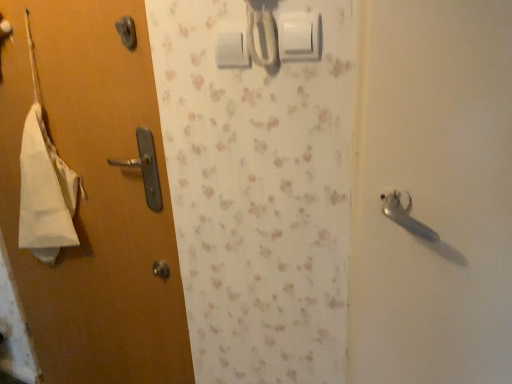
Question: Would you consider matte wood door at left to be distant from white plastic light switch at upper center, which is the 1th light switch in back-to-front order?

Choices:
 (A) yes
 (B) no

Answer: (B)

Question: Is white plastic light switch at upper center, arranged as the second light switch when viewed from the front, a part of matte wood door at left?

Choices:
 (A) no
 (B) yes

Answer: (A)

Question: Considering the relative sizes of matte wood door at left and white plastic light switch at upper center, which is the 1th light switch in back-to-front order, in the image provided, is matte wood door at left bigger than white plastic light switch at upper center, which is the 1th light switch in back-to-front order,?

Choices:
 (A) yes
 (B) no

Answer: (A)

Question: From the image's perspective, does matte wood door at left appear lower than white plastic light switch at upper center, which is the 1th light switch in back-to-front order?

Choices:
 (A) yes
 (B) no

Answer: (A)

Question: Is matte wood door at left shorter than white plastic light switch at upper center, marked as the 2th light switch in a right-to-left arrangement?

Choices:
 (A) yes
 (B) no

Answer: (B)

Question: Is matte wood door at left with white plastic light switch at upper center, arranged as the second light switch when viewed from the front?

Choices:
 (A) yes
 (B) no

Answer: (B)

Question: Is white plastic light switch at upper center, arranged as the second light switch when viewed from the front, next to white plastic light switch at upper center, which is the second light switch in back-to-front order, and touching it?

Choices:
 (A) yes
 (B) no

Answer: (B)

Question: From a real-world perspective, is white plastic light switch at upper center, marked as the 2th light switch in a right-to-left arrangement, on white plastic light switch at upper center, acting as the first light switch starting from the right?

Choices:
 (A) yes
 (B) no

Answer: (B)

Question: From a real-world perspective, is white plastic light switch at upper center, which is the first light switch in left-to-right order, beneath white plastic light switch at upper center, the 2th light switch in the left-to-right sequence?

Choices:
 (A) yes
 (B) no

Answer: (A)

Question: From the image's perspective, does white plastic light switch at upper center, marked as the 2th light switch in a right-to-left arrangement, appear lower than white plastic light switch at upper center, the 2th light switch in the left-to-right sequence?

Choices:
 (A) no
 (B) yes

Answer: (A)

Question: From the image's perspective, is white plastic light switch at upper center, marked as the 2th light switch in a right-to-left arrangement, on top of white plastic light switch at upper center, acting as the first light switch starting from the right?

Choices:
 (A) yes
 (B) no

Answer: (A)

Question: Is white plastic light switch at upper center, arranged as the second light switch when viewed from the front, smaller than white plastic light switch at upper center, which is the second light switch in back-to-front order?

Choices:
 (A) yes
 (B) no

Answer: (A)

Question: Considering the relative sizes of matte wood door at left and white plastic light switch at upper center, the 2th light switch in the left-to-right sequence, in the image provided, is matte wood door at left shorter than white plastic light switch at upper center, the 2th light switch in the left-to-right sequence,?

Choices:
 (A) no
 (B) yes

Answer: (A)